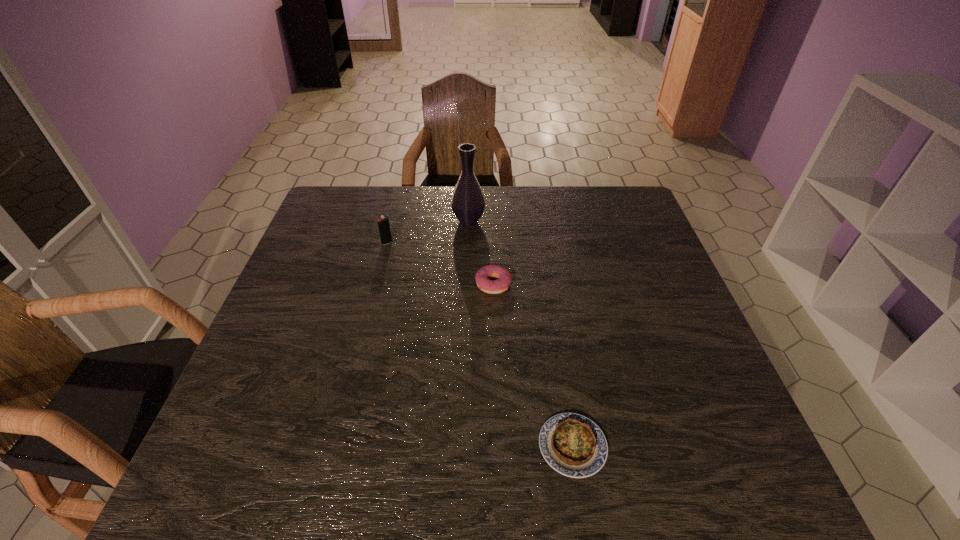
The image size is (960, 540). Find the location of `the farthest object`. the farthest object is located at coordinates (468, 203).

The width and height of the screenshot is (960, 540). In order to click on the tallest object in this screenshot , I will do `click(468, 203)`.

Where is `the second tallest object`? This screenshot has height=540, width=960. the second tallest object is located at coordinates pyautogui.click(x=383, y=224).

At what (x,y) coordinates should I click in order to perform the action: click on the leftmost object. Please return your answer as a coordinate pair (x, y). This screenshot has width=960, height=540. Looking at the image, I should click on (383, 224).

This screenshot has height=540, width=960. What are the coordinates of `the third farthest object` in the screenshot? It's located at (504, 277).

The image size is (960, 540). I want to click on doughnut, so click(504, 277).

You are a GUI agent. You are given a task and a screenshot of the screen. Output one action in this format:
    pyautogui.click(x=<x>, y=<y>)
    Task: Click on the nearest object
    The image size is (960, 540).
    Given the screenshot: What is the action you would take?
    pyautogui.click(x=572, y=444)

You are a GUI agent. You are given a task and a screenshot of the screen. Output one action in this format:
    pyautogui.click(x=<x>, y=<y>)
    Task: Click on the rightmost object
    
    Given the screenshot: What is the action you would take?
    pyautogui.click(x=572, y=444)

Identify the location of free space located on the right of the tallest object. (540, 221).

Where is `free space located on the front of the second tallest object`? This screenshot has width=960, height=540. free space located on the front of the second tallest object is located at coordinates (372, 306).